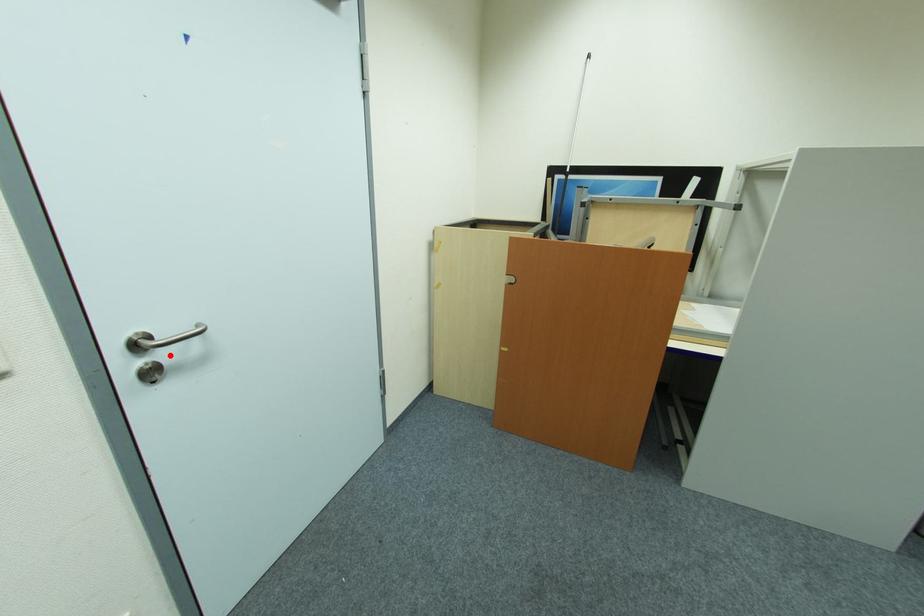
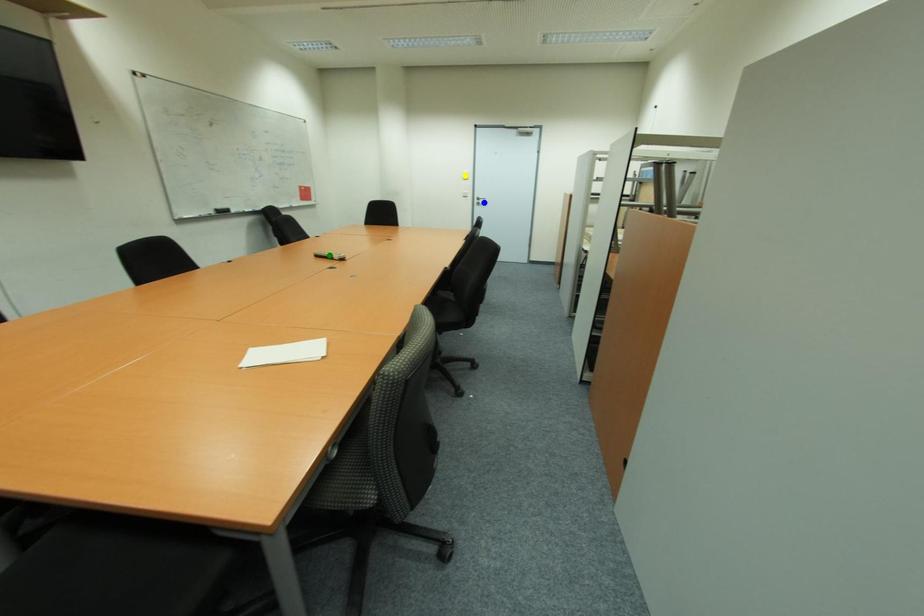
Question: I am providing you with two images of the same scene from different viewpoints. A red point is marked on the first image. You are given multiple points on the second image. Which point in image 2 represents the same 3d spot as the red point in image 1?

Choices:
 (A) blue point
 (B) green point
 (C) yellow point

Answer: (A)